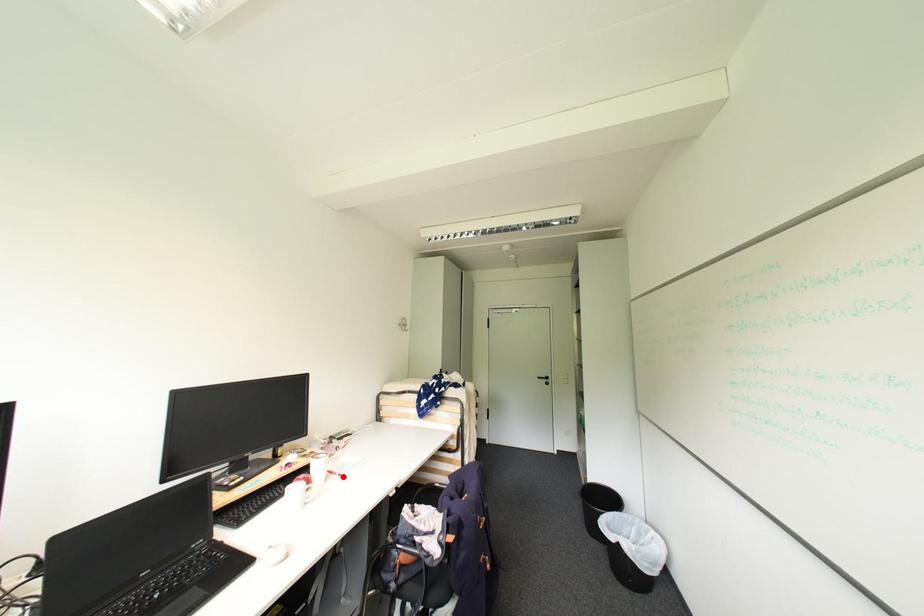
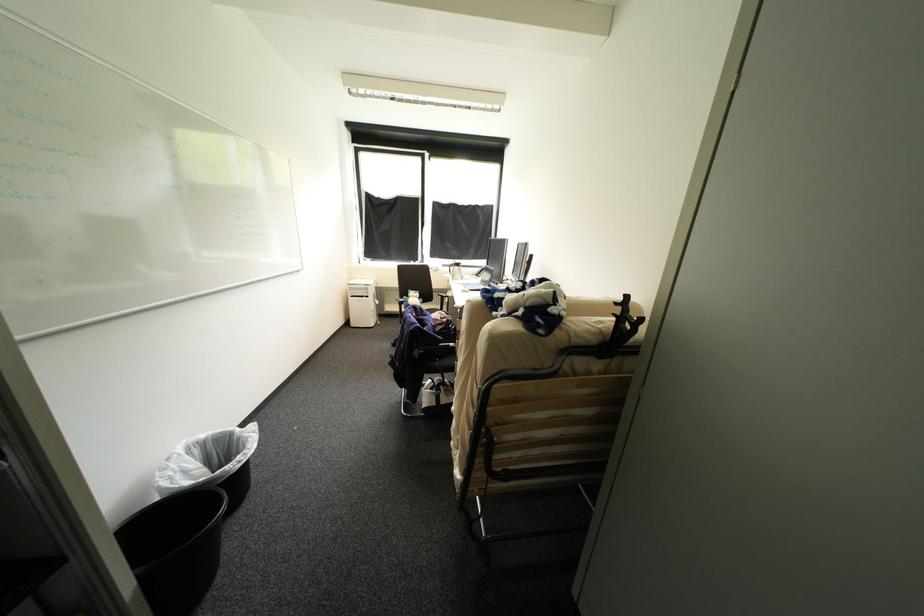
Question: I am providing you with two images of the same scene from different viewpoints. A red point is marked on the first image. Can you still see the location of the red point in image 2?

Choices:
 (A) Yes
 (B) No

Answer: (B)